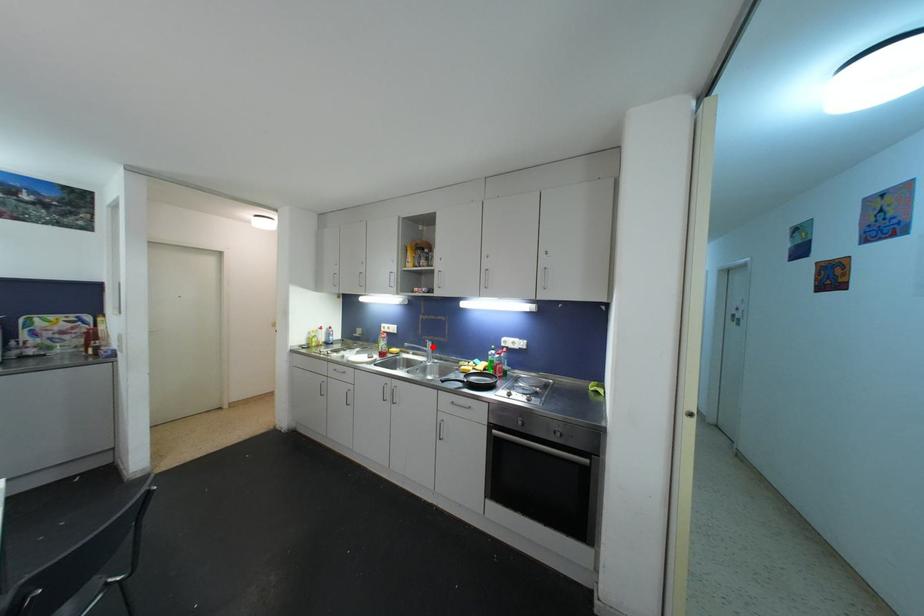
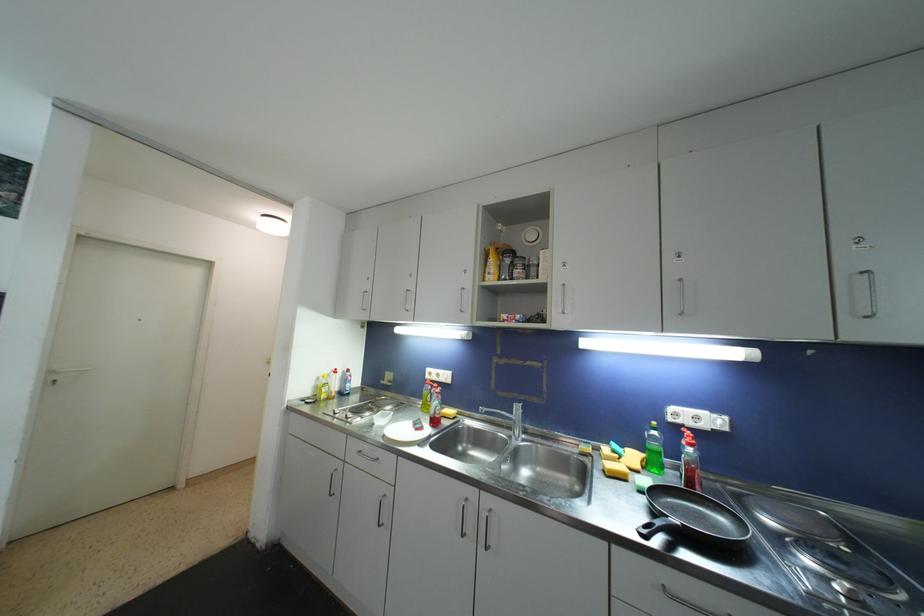
Find the pixel in the second image that matches the highlighted location in the first image.

(520, 411)